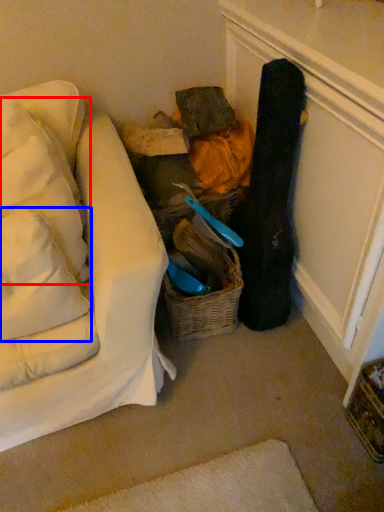
Question: Which of the following is the closest to the observer, pillow (highlighted by a red box) or pillow (highlighted by a blue box)?

Choices:
 (A) pillow
 (B) pillow

Answer: (B)